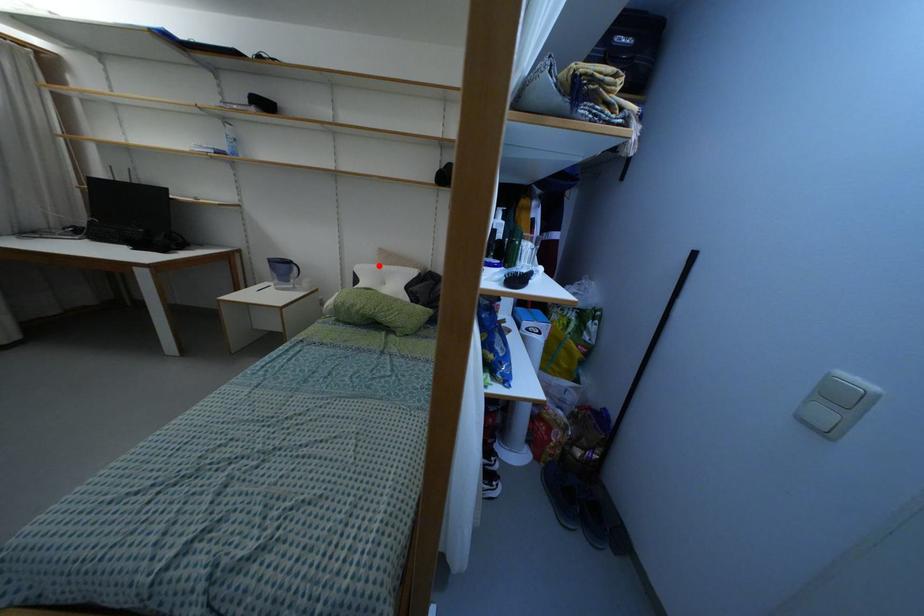
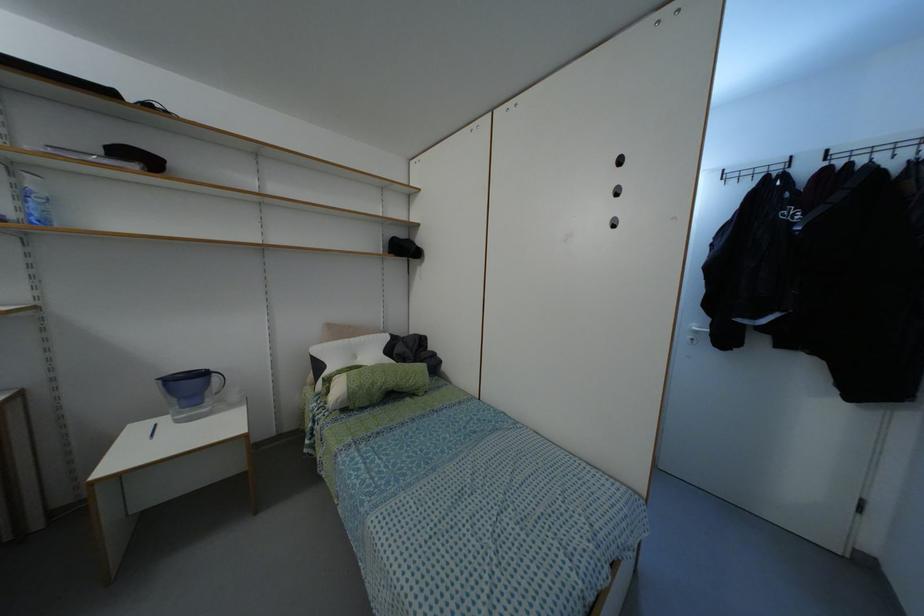
In the second image, find the point that corresponds to the highlighted location in the first image.

(345, 339)